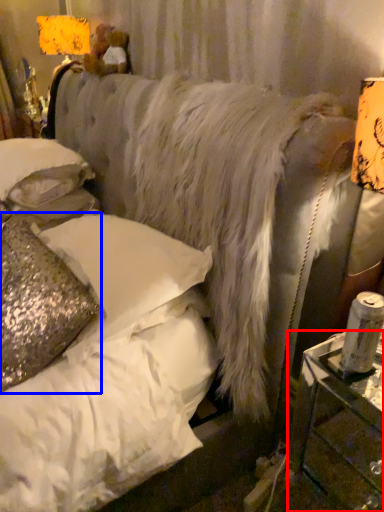
Question: Which object appears farthest to the camera in this image, table (highlighted by a red box) or pillow (highlighted by a blue box)?

Choices:
 (A) table
 (B) pillow

Answer: (B)